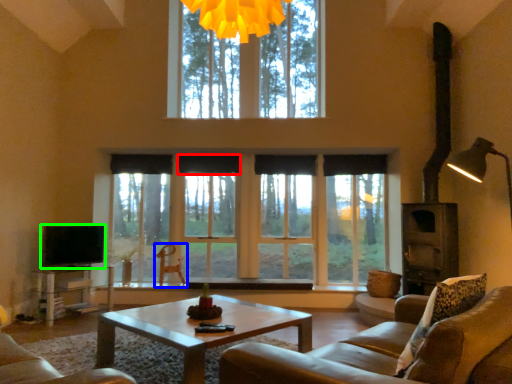
Question: Estimate the real-world distances between objects in this image. Which object is closer to curtain (highlighted by a red box), armchair (highlighted by a blue box) or level (highlighted by a green box)?

Choices:
 (A) armchair
 (B) level

Answer: (A)